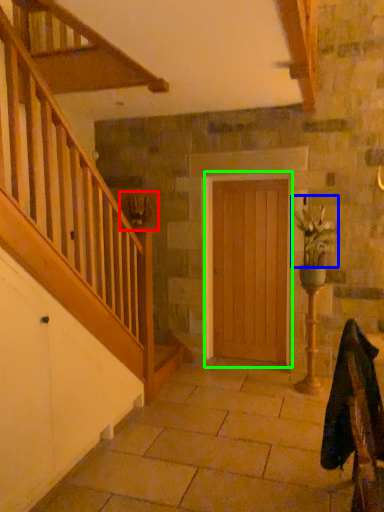
Question: Estimate the real-world distances between objects in this image. Which object is closer to plant (highlighted by a red box), floral arrangement (highlighted by a blue box) or door (highlighted by a green box)?

Choices:
 (A) floral arrangement
 (B) door

Answer: (B)